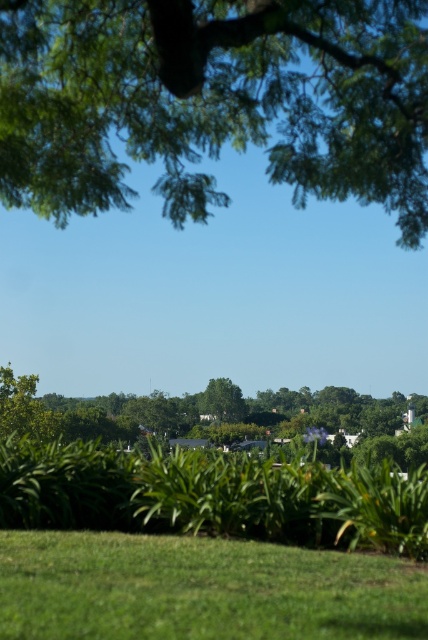
Question: Is green leafy tree at upper center further to the viewer compared to green leafy tree at center?

Choices:
 (A) no
 (B) yes

Answer: (A)

Question: Which point is closer to the camera?

Choices:
 (A) (21, 156)
 (B) (195, 621)

Answer: (B)

Question: Is green leafy tree at upper center above green grassy field at lower center?

Choices:
 (A) no
 (B) yes

Answer: (B)

Question: Based on their relative distances, which object is nearer to the green leafy tree at center?

Choices:
 (A) green grassy field at lower center
 (B) green leafy tree at upper center

Answer: (B)

Question: Which is nearer to the green leafy tree at center?

Choices:
 (A) green leafy tree at upper center
 (B) green grassy field at lower center

Answer: (A)

Question: Does green leafy tree at upper center have a greater width compared to green leafy tree at center?

Choices:
 (A) no
 (B) yes

Answer: (A)